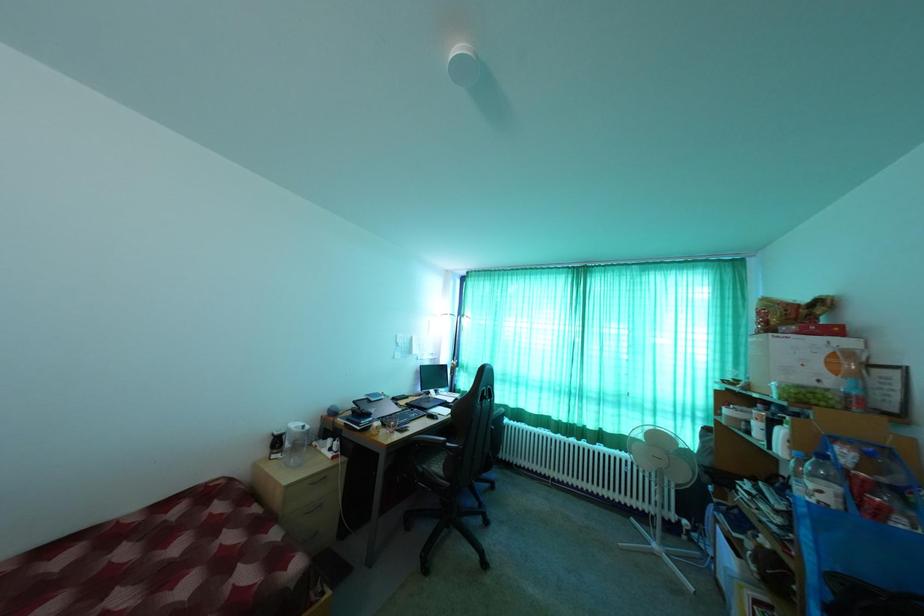
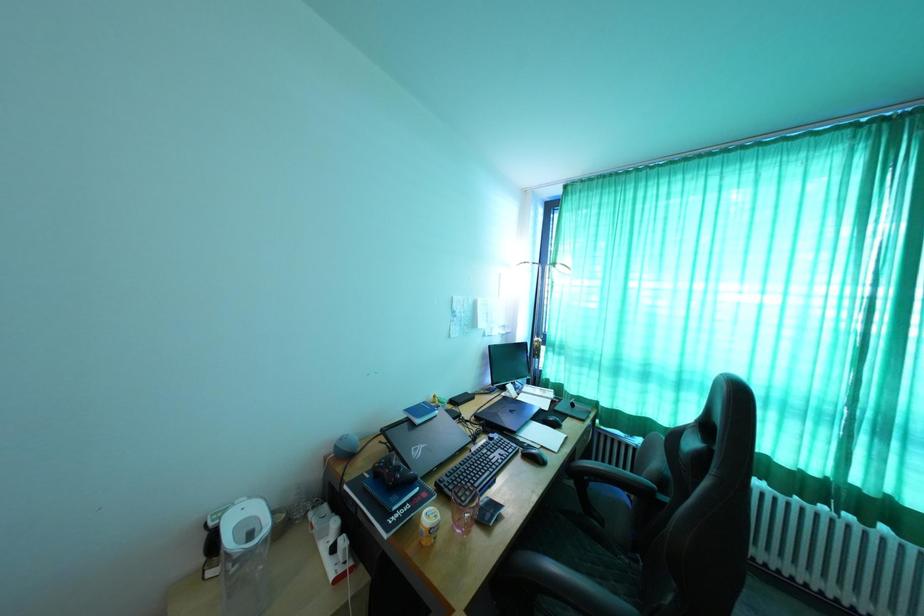
Question: What movement of the cameraman would produce the second image?

Choices:
 (A) Left
 (B) Right
 (C) Forward
 (D) Backward

Answer: (C)